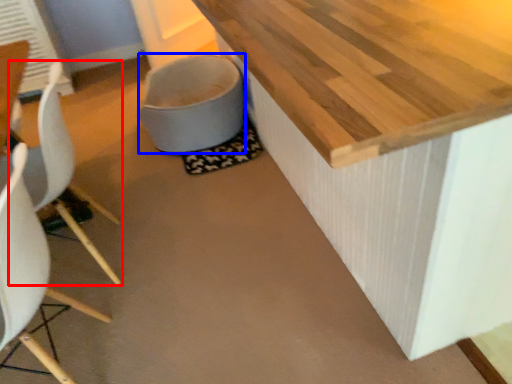
Question: Which of the following is the farthest to the observer, chair (highlighted by a red box) or toilet bowl (highlighted by a blue box)?

Choices:
 (A) chair
 (B) toilet bowl

Answer: (B)